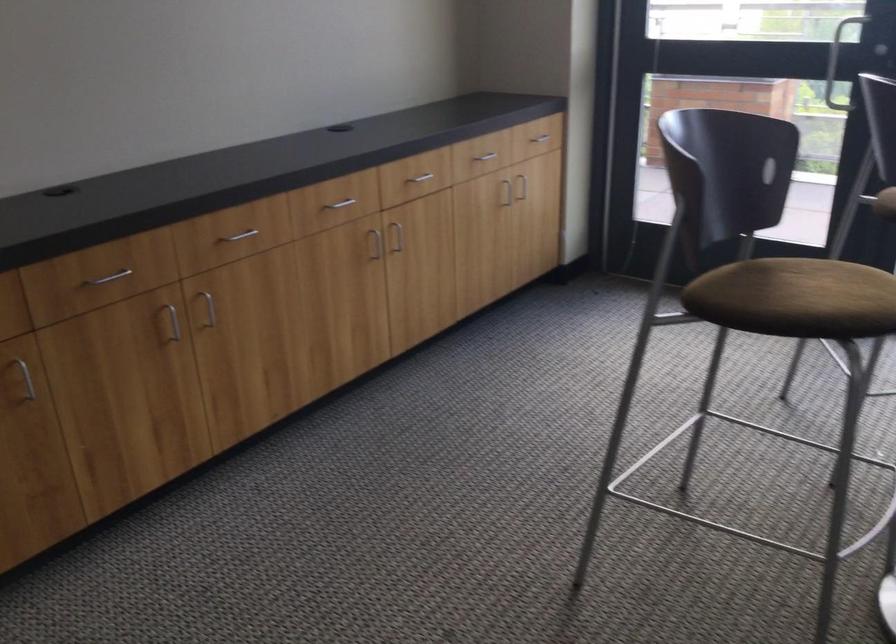
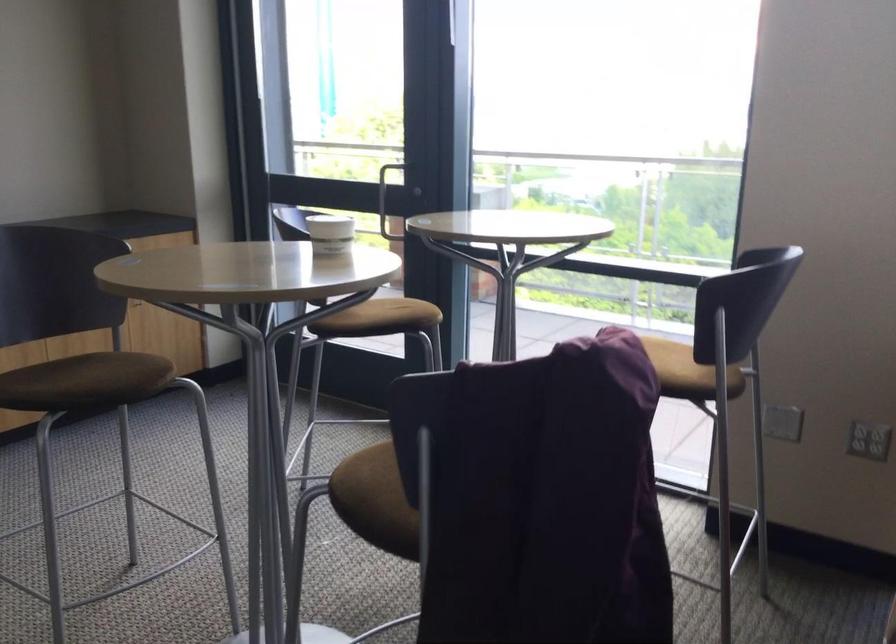
Where in the second image is the point corresponding to (416,265) from the first image?

(76, 344)